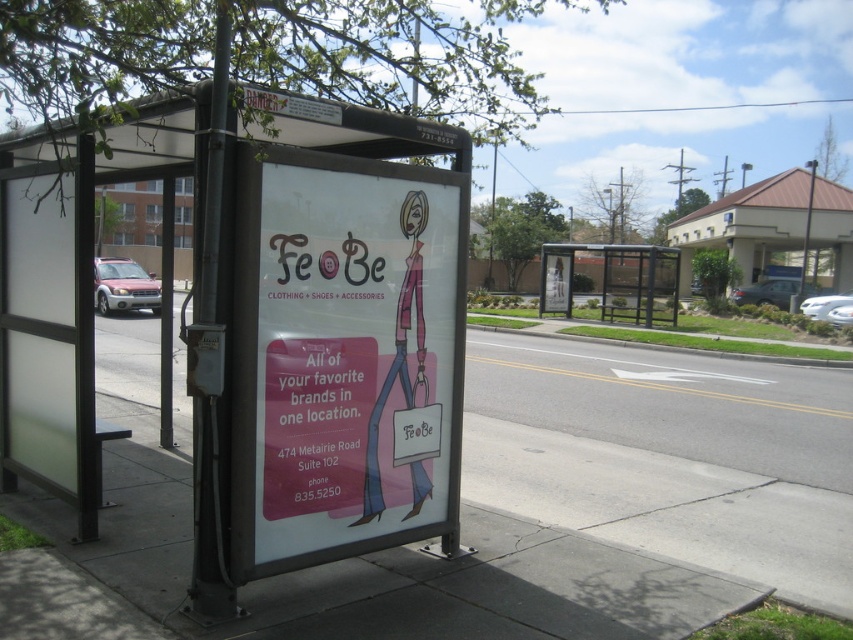
Is white concrete pavement at lower left positioned before matte pink poster at center?

No, it is not.

Is point (525, 474) more distant than point (293, 220)?

That is True.

Between point (752, 412) and point (453, 497), which one is positioned behind?

Positioned behind is point (752, 412).

This screenshot has width=853, height=640. Identify the location of white concrete pavement at lower left. (664, 458).

Is point (109, 465) positioned in front of point (670, 316)?

That is True.

I want to click on white concrete pavement at lower left, so click(x=664, y=458).

The height and width of the screenshot is (640, 853). What do you see at coordinates (664, 458) in the screenshot?
I see `white concrete pavement at lower left` at bounding box center [664, 458].

This screenshot has width=853, height=640. Identify the location of white concrete pavement at lower left. (664, 458).

Consider the image. Which of these two, white frosted glass bus stop at left or white concrete pavement at lower left, stands shorter?

white concrete pavement at lower left is shorter.

Is white frosted glass bus stop at left smaller than white concrete pavement at lower left?

Correct, white frosted glass bus stop at left occupies less space than white concrete pavement at lower left.

Locate an element on the screen. The height and width of the screenshot is (640, 853). white frosted glass bus stop at left is located at coordinates (264, 326).

Identify the location of white frosted glass bus stop at left. The width and height of the screenshot is (853, 640). (264, 326).